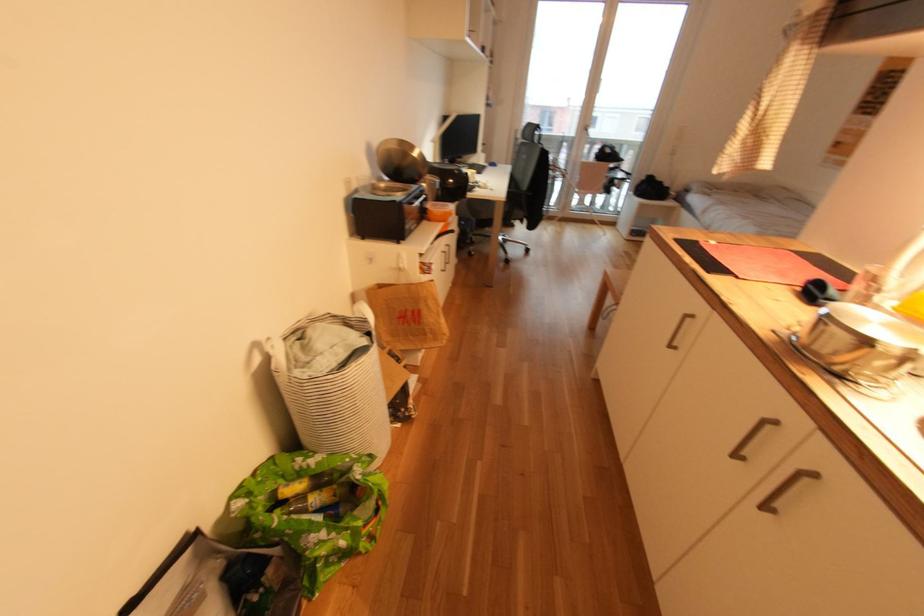
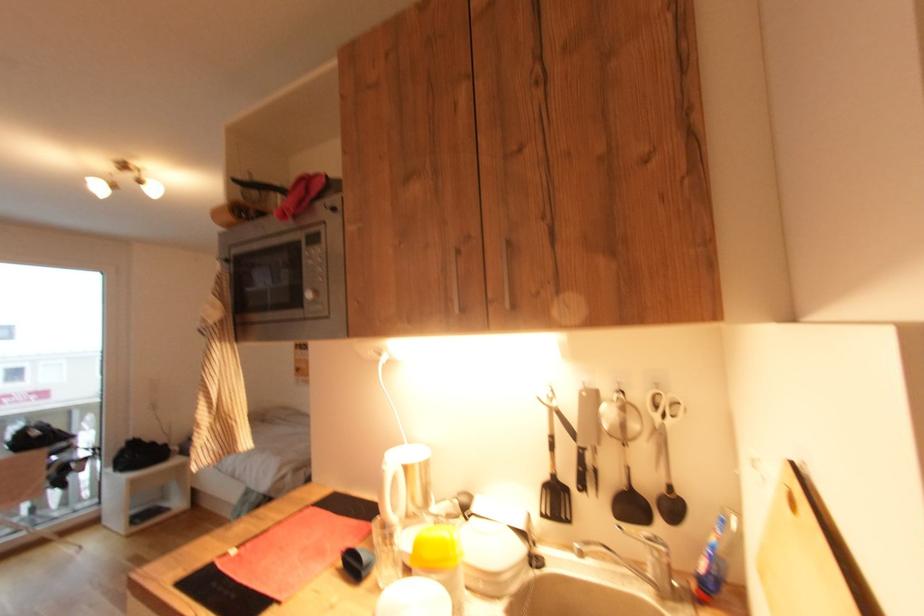
Question: How did the camera likely rotate?

Choices:
 (A) Left
 (B) Right
 (C) Up
 (D) Down

Answer: (B)